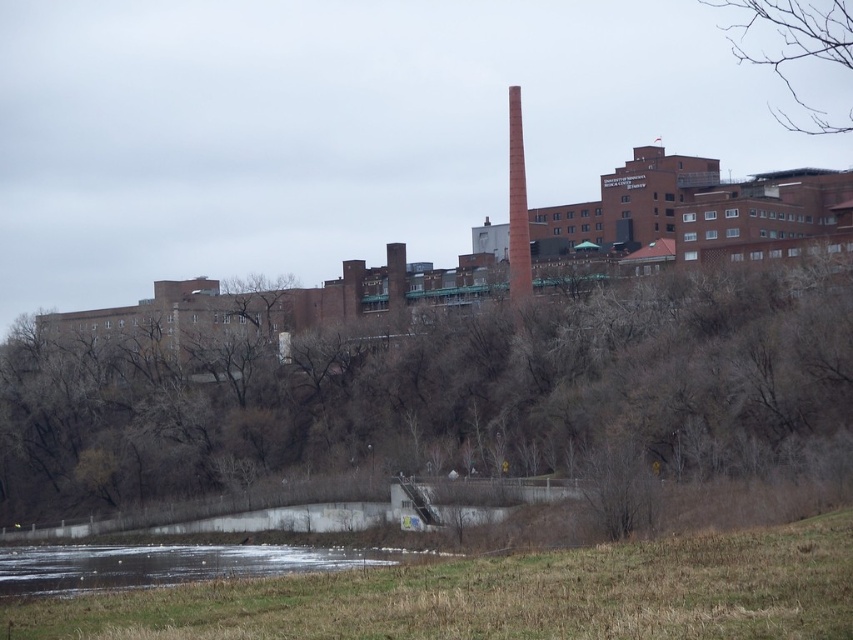
Question: Which point is farther to the camera?

Choices:
 (A) (148, 358)
 (B) (845, 29)

Answer: (B)

Question: Is bare branches at upper right smaller than red brick chimney at upper right?

Choices:
 (A) yes
 (B) no

Answer: (B)

Question: Which point is closer to the camera?

Choices:
 (A) (94, 362)
 (B) (801, 29)

Answer: (A)

Question: In this image, where is brown leafless trees at upper center located relative to red brick chimney at upper right?

Choices:
 (A) right
 (B) left

Answer: (B)

Question: Among these objects, which one is farthest from the camera?

Choices:
 (A) red brick chimney at upper right
 (B) brown leafless trees at upper center

Answer: (A)

Question: Can you confirm if brown leafless trees at upper center is smaller than bare branches at upper right?

Choices:
 (A) no
 (B) yes

Answer: (B)